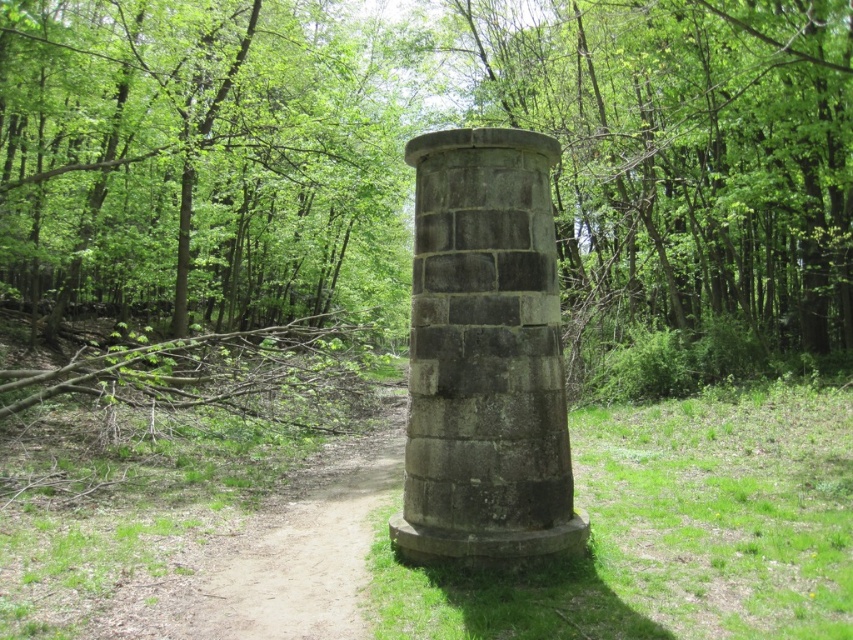
You are a hiker who wants to take a photo of the gray stone column at center without the dirt path at lower left appearing in the frame. Which object should you move closer to, and why?

You should move closer to the gray stone column at center. Since it is larger than the dirt path at lower left, getting closer to it will make it fill the frame more, thereby obscuring or reducing the visibility of the dirt path at lower left in the background.

You are a hiker who wants to approach the gray stone column at center from the dirt path at lower left. Which direction should you turn to reach it?

The gray stone column at center is positioned on the right side of the dirt path at lower left, so you should turn right to reach it.